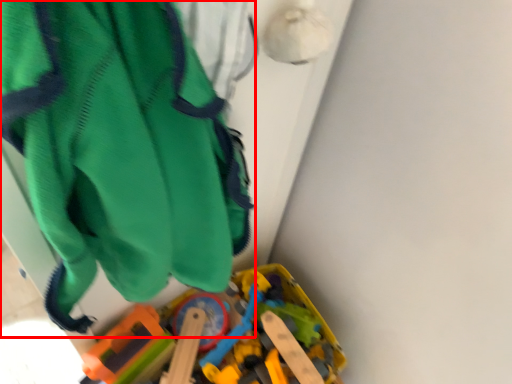
Question: Observing the image, what is the correct spatial positioning of wide (annotated by the red box) in reference to toy?

Choices:
 (A) right
 (B) left

Answer: (B)